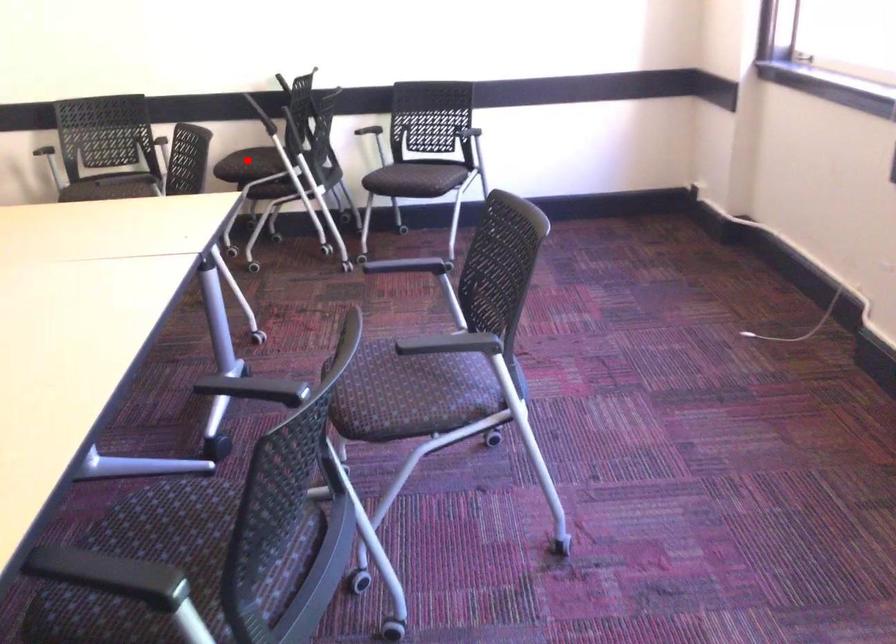
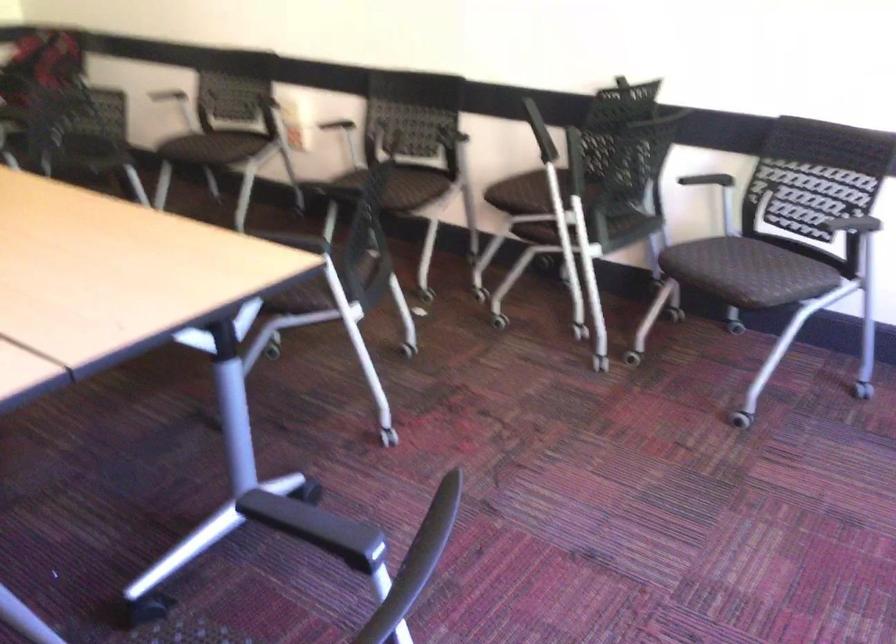
Question: A red point is marked in image1. In image2, is the corresponding 3D point closer to the camera or farther? Reply with the corresponding letter.

Choices:
 (A) The corresponding 3D point is closer.
 (B) The corresponding 3D point is farther.

Answer: (A)